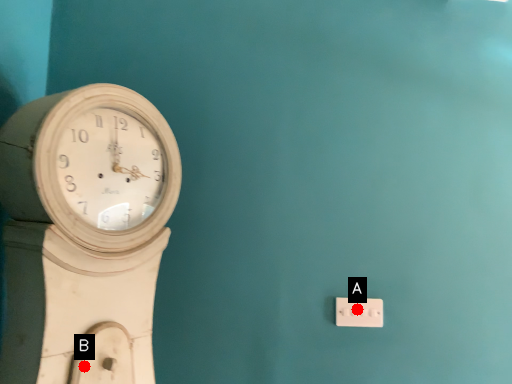
Question: Two points are circled on the image, labeled by A and B beside each circle. Which of the following is the farthest from the observer?

Choices:
 (A) A is further
 (B) B is further

Answer: (A)